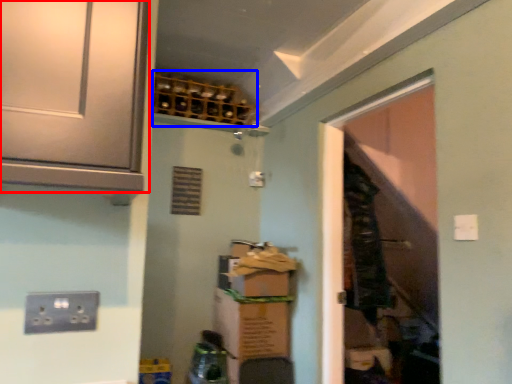
Question: Which of the following is the farthest to the observer, cabinetry (highlighted by a red box) or wine rack (highlighted by a blue box)?

Choices:
 (A) cabinetry
 (B) wine rack

Answer: (B)